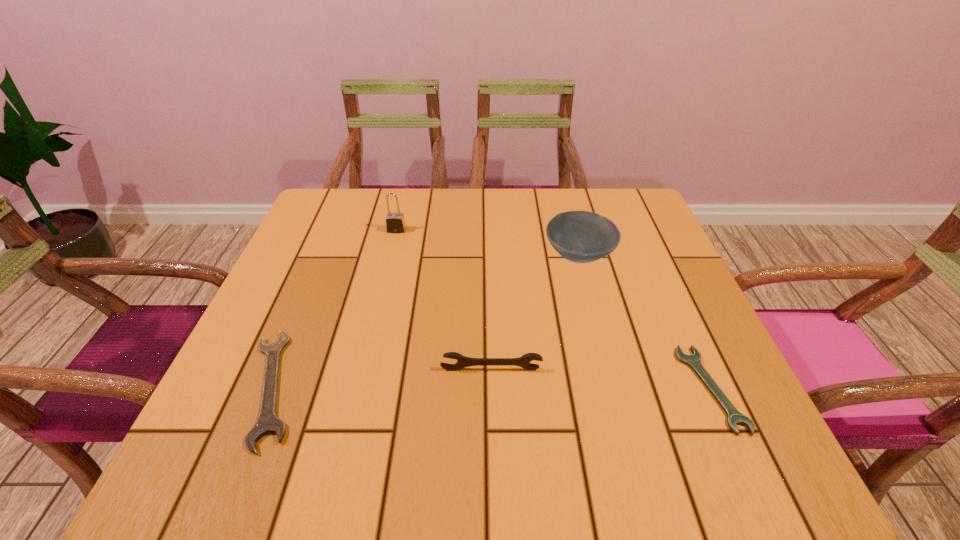
Identify which object is the closest to the fourth tallest object. Please provide its 2D coordinates. Your answer should be formatted as a tuple, i.e. [(x, y)], where the tuple contains the x and y coordinates of a point satisfying the conditions above.

[(524, 361)]

Locate an element on the screen. wrench that is the third closest to the farthest object is located at coordinates (734, 417).

Point out which wrench is positioned as the second nearest to the padlock. Please provide its 2D coordinates. Your answer should be formatted as a tuple, i.e. [(x, y)], where the tuple contains the x and y coordinates of a point satisfying the conditions above.

[(524, 361)]

Where is `free spot that satisfies the following two spatial constraints: 1. on the open ends of the shortest object; 2. on the right side of the third object from left to right`? free spot that satisfies the following two spatial constraints: 1. on the open ends of the shortest object; 2. on the right side of the third object from left to right is located at coordinates (492, 388).

Where is `vacant space that satisfies the following two spatial constraints: 1. on the front side of the shortest wrench; 2. on the left side of the fourth tallest object`? vacant space that satisfies the following two spatial constraints: 1. on the front side of the shortest wrench; 2. on the left side of the fourth tallest object is located at coordinates (272, 388).

The image size is (960, 540). Identify the location of free space that satisfies the following two spatial constraints: 1. on the open ends of the shortest wrench; 2. on the right side of the third shortest object. (492, 388).

At what (x,y) coordinates should I click in order to perform the action: click on vacant position in the image that satisfies the following two spatial constraints: 1. on the shackle of the padlock; 2. on the left side of the rightmost object. Please return your answer as a coordinate pair (x, y). Looking at the image, I should click on (359, 388).

Where is `vacant position in the image that satisfies the following two spatial constraints: 1. on the open ends of the tallest wrench; 2. on the left side of the shortest object`? vacant position in the image that satisfies the following two spatial constraints: 1. on the open ends of the tallest wrench; 2. on the left side of the shortest object is located at coordinates (492, 388).